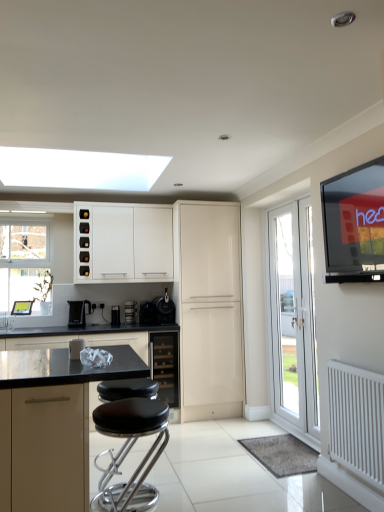
Image resolution: width=384 pixels, height=512 pixels. Find the location of `flat-screen tv at upper right`. flat-screen tv at upper right is located at coordinates (354, 224).

What do you see at coordinates (293, 317) in the screenshot? The image size is (384, 512). I see `white glossy door at right` at bounding box center [293, 317].

In order to click on black leather stool at center in this screenshot , I will do `click(129, 450)`.

Image resolution: width=384 pixels, height=512 pixels. What do you see at coordinates (79, 313) in the screenshot?
I see `black plastic coffee machine at lower left` at bounding box center [79, 313].

The height and width of the screenshot is (512, 384). What do you see at coordinates (157, 310) in the screenshot? I see `black matte coffee maker at center, the first appliance when ordered from right to left` at bounding box center [157, 310].

Find the location of a particular element. The height and width of the screenshot is (512, 384). flat-screen tv at upper right is located at coordinates (354, 224).

Is white glossy door at right inside the boundaries of satin black wine cooler at center, which is the 3th appliance in left-to-right order, or outside?

white glossy door at right is located beyond the bounds of satin black wine cooler at center, which is the 3th appliance in left-to-right order.

Is white glossy door at right not near satin black wine cooler at center, which is counted as the 2th appliance, starting from the right?

That's right, there is a large distance between white glossy door at right and satin black wine cooler at center, which is counted as the 2th appliance, starting from the right.

From the image's perspective, between white glossy door at right and satin black wine cooler at center, which is the 3th appliance in left-to-right order, who is located below?

satin black wine cooler at center, which is the 3th appliance in left-to-right order.

Considering the sizes of objects white glossy door at right and satin black wine cooler at center, which is the 3th appliance in left-to-right order, in the image provided, who is taller, white glossy door at right or satin black wine cooler at center, which is the 3th appliance in left-to-right order,?

Standing taller between the two is white glossy door at right.

Considering the sizes of objects flat-screen tv at upper right and black matte coffee maker at center, positioned as the fourth appliance in left-to-right order, in the image provided, who is shorter, flat-screen tv at upper right or black matte coffee maker at center, positioned as the fourth appliance in left-to-right order,?

Standing shorter between the two is black matte coffee maker at center, positioned as the fourth appliance in left-to-right order.

Considering the points (341, 186) and (164, 314), which point is in front, point (341, 186) or point (164, 314)?

The point (341, 186) is more forward.

Which object is closer to the camera, black glass wine cooler at center, which is the 3th cabinetry in back-to-front order, or flat-screen tv at upper right?

flat-screen tv at upper right is more forward.

Is black glass wine cooler at center, the 3th cabinetry viewed from the front, inside or outside of flat-screen tv at upper right?

The correct answer is: outside.

What's the angular difference between black glass wine cooler at center, which is the 3th cabinetry in back-to-front order, and flat-screen tv at upper right's facing directions?

The angular difference between black glass wine cooler at center, which is the 3th cabinetry in back-to-front order, and flat-screen tv at upper right is 87.4 degrees.

Measure the distance between black glass wine cooler at center, which is the 3th cabinetry in back-to-front order, and flat-screen tv at upper right.

black glass wine cooler at center, which is the 3th cabinetry in back-to-front order, and flat-screen tv at upper right are 2.19 meters apart.

Is black plastic toaster at center, the 1th appliance from the left, further to the viewer compared to flat-screen tv at upper right?

Yes, the depth of black plastic toaster at center, the 1th appliance from the left, is greater than that of flat-screen tv at upper right.

From a real-world perspective, is black plastic toaster at center, the 1th appliance from the left, physically located above or below flat-screen tv at upper right?

In terms of real-world spatial position, black plastic toaster at center, the 1th appliance from the left, is below flat-screen tv at upper right.

Image resolution: width=384 pixels, height=512 pixels. What are the coordinates of `window screen above the black plastic toaster at center, the fourth appliance positioned from the right (from a real-world perspective)` in the screenshot? It's located at (354, 224).

Is flat-screen tv at upper right located within black plastic toaster at center, the 1th appliance from the left?

Definitely not — flat-screen tv at upper right is not inside black plastic toaster at center, the 1th appliance from the left.

From the image's perspective, is black glass wine cooler at center, the 3th cabinetry viewed from the front, positioned above or below black plastic toaster at center, which ranks as the 3th appliance in right-to-left order?

Based on their image positions, black glass wine cooler at center, the 3th cabinetry viewed from the front, is located beneath black plastic toaster at center, which ranks as the 3th appliance in right-to-left order.

Does black glass wine cooler at center, which is the 3th cabinetry in back-to-front order, turn towards black plastic toaster at center, which is counted as the second appliance, starting from the left?

No, black glass wine cooler at center, which is the 3th cabinetry in back-to-front order, is not turned towards black plastic toaster at center, which is counted as the second appliance, starting from the left.

Is black glass wine cooler at center, which is the 3th cabinetry in back-to-front order, positioned beyond the bounds of black plastic toaster at center, which is counted as the second appliance, starting from the left?

Yes, black glass wine cooler at center, which is the 3th cabinetry in back-to-front order, is located beyond the bounds of black plastic toaster at center, which is counted as the second appliance, starting from the left.

Who is shorter, black glass wine cooler at center, the 3th cabinetry viewed from the front, or black plastic toaster at center, which ranks as the 3th appliance in right-to-left order?

black plastic toaster at center, which ranks as the 3th appliance in right-to-left order, is shorter.

From a real-world perspective, is matte black countertop at center, placed as the 5th cabinetry when sorted from back to front, physically located above or below white matte radiator at lower right?

From a real-world perspective, matte black countertop at center, placed as the 5th cabinetry when sorted from back to front, is physically below white matte radiator at lower right.

Would you consider matte black countertop at center, placed as the 5th cabinetry when sorted from back to front, to be distant from white matte radiator at lower right?

Absolutely, matte black countertop at center, placed as the 5th cabinetry when sorted from back to front, is distant from white matte radiator at lower right.

Which of these two, matte black countertop at center, placed as the 5th cabinetry when sorted from back to front, or white matte radiator at lower right, is wider?

matte black countertop at center, placed as the 5th cabinetry when sorted from back to front, is wider.

Based on the photo, considering the sizes of objects matte black countertop at center, placed as the 5th cabinetry when sorted from back to front, and white matte radiator at lower right in the image provided, who is taller, matte black countertop at center, placed as the 5th cabinetry when sorted from back to front, or white matte radiator at lower right?

matte black countertop at center, placed as the 5th cabinetry when sorted from back to front.

From the picture: From the image's perspective, does black matte countertop at center, placed as the 4th cabinetry when sorted from back to front, appear lower than flat-screen tv at upper right?

Correct, black matte countertop at center, placed as the 4th cabinetry when sorted from back to front, appears lower than flat-screen tv at upper right in the image.

Can you tell me how much black matte countertop at center, the second cabinetry positioned from the front, and flat-screen tv at upper right differ in facing direction?

The facing directions of black matte countertop at center, the second cabinetry positioned from the front, and flat-screen tv at upper right are 89.2 degrees apart.

Looking at this image, is black matte countertop at center, the second cabinetry positioned from the front, outside of flat-screen tv at upper right?

Indeed, black matte countertop at center, the second cabinetry positioned from the front, is completely outside flat-screen tv at upper right.

Considering the positions of point (171, 362) and point (330, 253), is point (171, 362) closer or farther from the camera than point (330, 253)?

Point (171, 362) is farther from the camera than point (330, 253).

The height and width of the screenshot is (512, 384). What are the coordinates of `the 1st appliance below the white glossy door at right (from the image's perspective)` in the screenshot? It's located at (147, 313).

Which appliance is the 1st one when counting from the back of the flat-screen tv at upper right? Please provide its 2D coordinates.

[(157, 310)]

Which object lies nearer to the anchor point black glass wine cooler at center, the 3th cabinetry viewed from the front, white matte radiator at lower right or black matte countertop at center, placed as the 4th cabinetry when sorted from back to front?

black matte countertop at center, placed as the 4th cabinetry when sorted from back to front, is positioned closer to the anchor black glass wine cooler at center, the 3th cabinetry viewed from the front.

Considering their positions, is black matte coffee maker at center, the first appliance when ordered from right to left, positioned closer to white glossy door at right than black plastic toaster at center, the fourth appliance positioned from the right?

black matte coffee maker at center, the first appliance when ordered from right to left, is closer to white glossy door at right.

Considering their positions, is black leather stool at center positioned further to black glass wine cooler at center, the 3th cabinetry viewed from the front, than glossy cream cabinet at center, placed as the 4th cabinetry when sorted from front to back?

black leather stool at center.

Estimate the real-world distances between objects in this image. Which object is further from black leather stool at center, black plastic toaster at center, which is counted as the second appliance, starting from the left, or black plastic toaster at center, the 1th appliance from the left?

Among the two, black plastic toaster at center, the 1th appliance from the left, is located further to black leather stool at center.

Based on their spatial positions, is white matte cabinet at upper left, which is the fifth cabinetry in front-to-back order, or black matte coffee maker at center, positioned as the fourth appliance in left-to-right order, closer to black glass wine cooler at center, the 3th cabinetry viewed from the front?

black matte coffee maker at center, positioned as the fourth appliance in left-to-right order, is positioned closer to the anchor black glass wine cooler at center, the 3th cabinetry viewed from the front.

Consider the image. Which object lies nearer to the anchor point matte black countertop at center, the 1th cabinetry from the front, white matte cabinet at upper left, the first cabinetry in the back-to-front sequence, or flat-screen tv at upper right?

flat-screen tv at upper right.

Which object lies nearer to the anchor point black matte coffee maker at center, positioned as the fourth appliance in left-to-right order, white matte cabinet at upper left, which is the fifth cabinetry in front-to-back order, or white matte radiator at lower right?

white matte cabinet at upper left, which is the fifth cabinetry in front-to-back order.

Based on their spatial positions, is matte black countertop at center, placed as the 5th cabinetry when sorted from back to front, or glossy cream cabinet at center, placed as the 4th cabinetry when sorted from front to back, further from flat-screen tv at upper right?

glossy cream cabinet at center, placed as the 4th cabinetry when sorted from front to back, is further to flat-screen tv at upper right.

This screenshot has width=384, height=512. Find the location of `door between white matte radiator at lower right and satin black wine cooler at center, which is counted as the 2th appliance, starting from the right, from front to back`. door between white matte radiator at lower right and satin black wine cooler at center, which is counted as the 2th appliance, starting from the right, from front to back is located at coordinates (293, 317).

This screenshot has width=384, height=512. In order to click on window screen between white matte radiator at lower right and black plastic toaster at center, the 1th appliance from the left, in the front-back direction in this screenshot , I will do `click(354, 224)`.

Where is `door between flat-screen tv at upper right and black matte coffee maker at center, the first appliance when ordered from right to left, along the z-axis`? The image size is (384, 512). door between flat-screen tv at upper right and black matte coffee maker at center, the first appliance when ordered from right to left, along the z-axis is located at coordinates (293, 317).

This screenshot has height=512, width=384. What are the coordinates of `window screen between matte black countertop at center, the 1th cabinetry from the front, and black plastic toaster at center, which is counted as the second appliance, starting from the left, along the z-axis` in the screenshot? It's located at (354, 224).